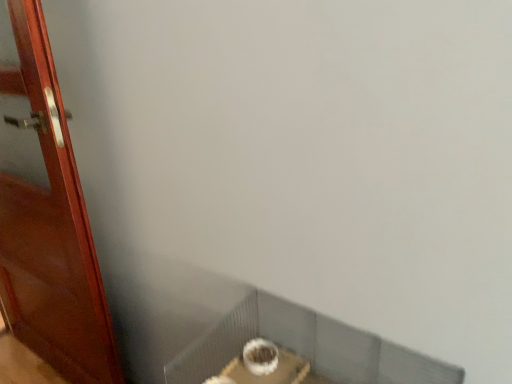
Question: Is wooden door at left surrounded by white textured tile at upper center?

Choices:
 (A) no
 (B) yes

Answer: (A)

Question: Is white textured tile at upper center in contact with wooden door at left?

Choices:
 (A) yes
 (B) no

Answer: (B)

Question: From the image's perspective, is white textured tile at upper center above wooden door at left?

Choices:
 (A) no
 (B) yes

Answer: (A)

Question: Is white textured tile at upper center not inside wooden door at left?

Choices:
 (A) no
 (B) yes

Answer: (B)

Question: Considering the relative positions of white textured tile at upper center and wooden door at left in the image provided, is white textured tile at upper center to the left of wooden door at left from the viewer's perspective?

Choices:
 (A) yes
 (B) no

Answer: (B)

Question: From a real-world perspective, is white textured tile at upper center under wooden door at left?

Choices:
 (A) yes
 (B) no

Answer: (A)

Question: Is wooden door at left surrounding white textured tile at upper center?

Choices:
 (A) yes
 (B) no

Answer: (B)

Question: Is wooden door at left bigger than white textured tile at upper center?

Choices:
 (A) yes
 (B) no

Answer: (A)

Question: Does wooden door at left have a lesser height compared to white textured tile at upper center?

Choices:
 (A) yes
 (B) no

Answer: (B)

Question: Is wooden door at left behind white textured tile at upper center?

Choices:
 (A) no
 (B) yes

Answer: (B)

Question: Is wooden door at left looking in the opposite direction of white textured tile at upper center?

Choices:
 (A) yes
 (B) no

Answer: (B)

Question: Could you tell me if wooden door at left is turned towards white textured tile at upper center?

Choices:
 (A) yes
 (B) no

Answer: (B)

Question: From a real-world perspective, relative to wooden door at left, is white textured tile at upper center vertically above or below?

Choices:
 (A) above
 (B) below

Answer: (B)